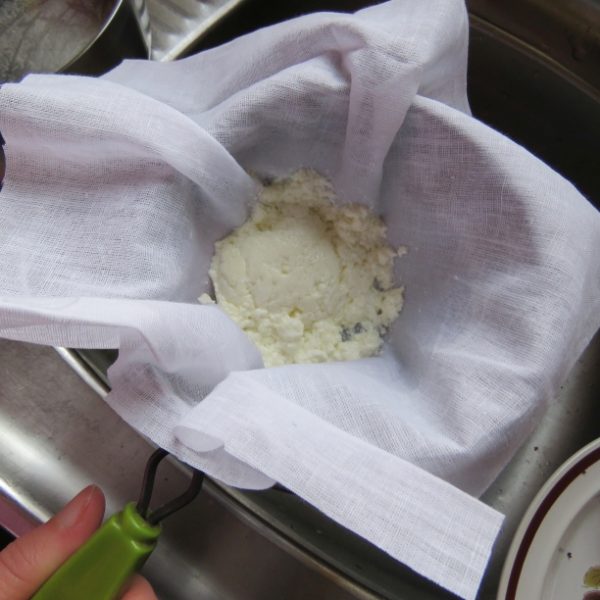
Locate an element on the screen. This screenshot has height=600, width=600. grayish white plate is located at coordinates (569, 557).